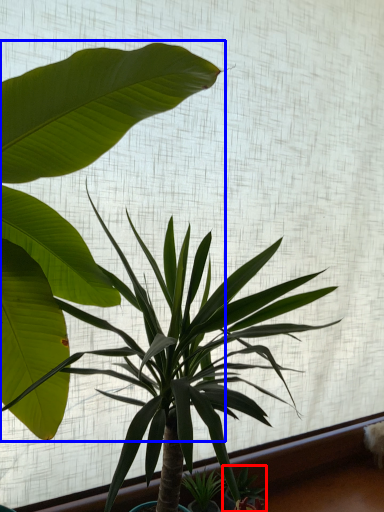
Question: Which object is further to the camera taking this photo, plant (highlighted by a red box) or houseplant (highlighted by a blue box)?

Choices:
 (A) plant
 (B) houseplant

Answer: (A)